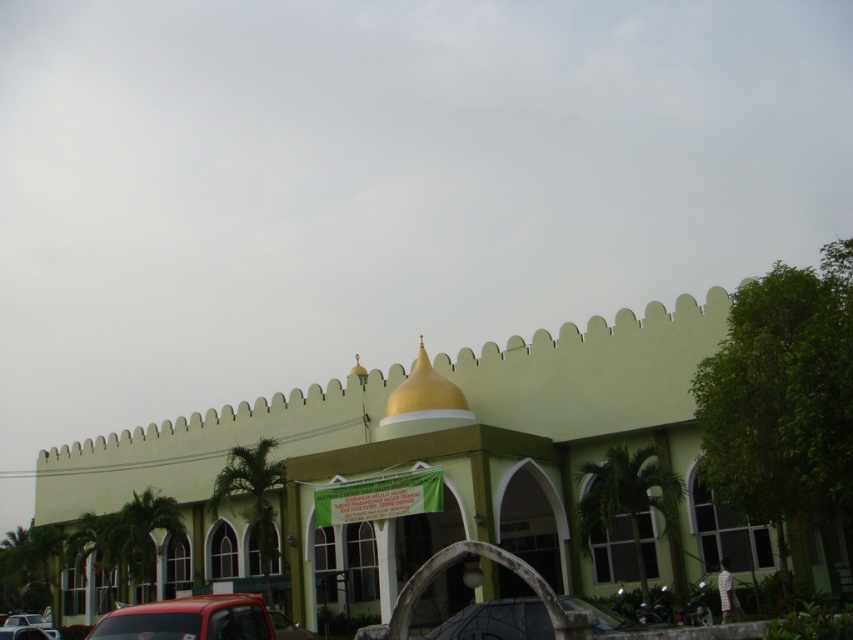
Question: Which is nearer to the green matte building at center?

Choices:
 (A) metallic red truck at lower left
 (B) metallic red car at lower left
 (C) metallic silver car at lower center

Answer: (C)

Question: Is metallic silver car at lower center bigger than metallic red car at lower left?

Choices:
 (A) no
 (B) yes

Answer: (A)

Question: Is green matte building at center further to the viewer compared to metallic silver car at lower center?

Choices:
 (A) no
 (B) yes

Answer: (B)

Question: Can you confirm if metallic silver car at lower center is bigger than metallic red car at lower left?

Choices:
 (A) no
 (B) yes

Answer: (A)

Question: Which point appears farthest from the camera in this image?

Choices:
 (A) (38, 480)
 (B) (148, 634)
 (C) (477, 625)
 (D) (18, 630)

Answer: (A)

Question: Which object is the closest to the metallic red car at lower left?

Choices:
 (A) green matte building at center
 (B) metallic red truck at lower left

Answer: (B)